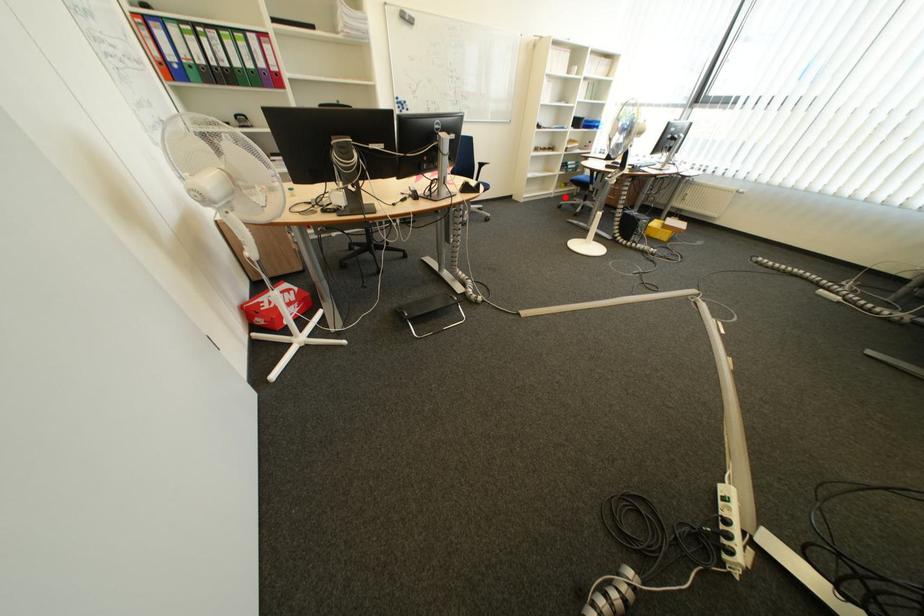
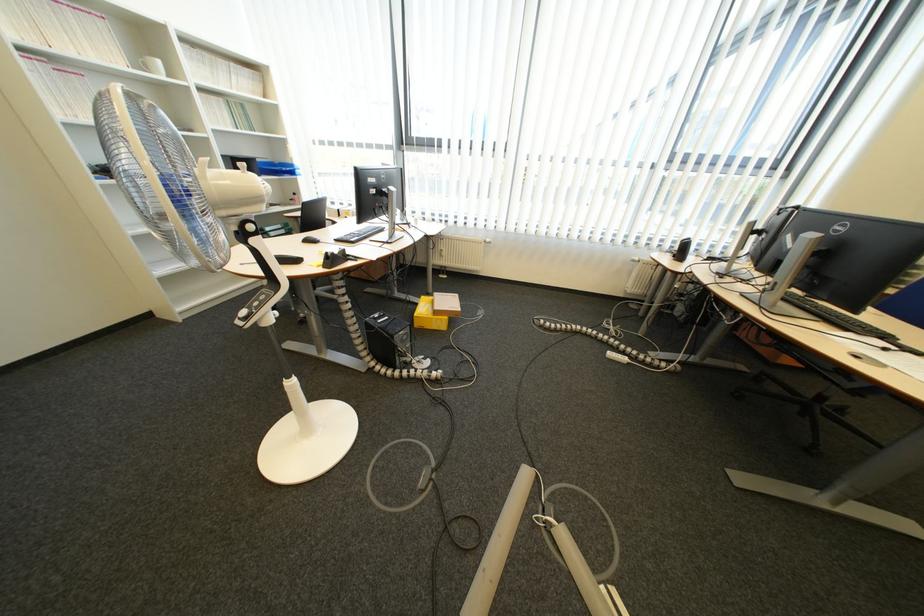
Question: I am providing you with two images of the same scene from different viewpoints. Image1 has a red point marked. In image2, the corresponding 3D location appears at what relative position? Reply with the corresponding letter.

Choices:
 (A) Closer
 (B) Farther

Answer: (B)